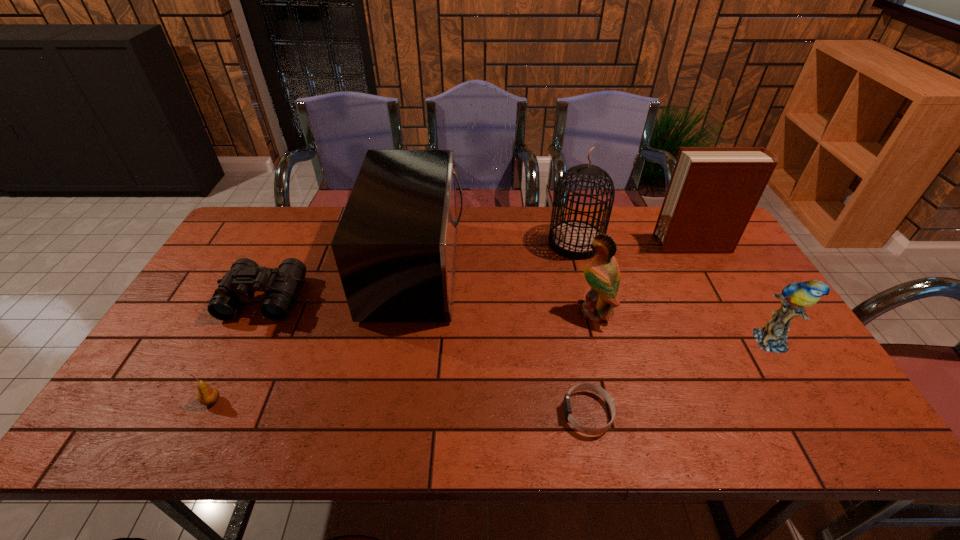
Where is `object present at the far right corner`? The height and width of the screenshot is (540, 960). object present at the far right corner is located at coordinates (713, 191).

Find the location of `free space at the far edge of the desktop`. free space at the far edge of the desktop is located at coordinates (527, 230).

Image resolution: width=960 pixels, height=540 pixels. Identify the location of free space at the near edge of the desktop. (257, 417).

Locate an element on the screen. This screenshot has height=540, width=960. free space at the left edge of the desktop is located at coordinates (171, 365).

In the image, there is a desktop. At what (x,y) coordinates should I click in order to perform the action: click on vacant space at the right edge. Please return your answer as a coordinate pair (x, y). Image resolution: width=960 pixels, height=540 pixels. Looking at the image, I should click on [711, 278].

Locate an element on the screen. Image resolution: width=960 pixels, height=540 pixels. free space between the seventh tallest object and the hardback book is located at coordinates (453, 323).

This screenshot has height=540, width=960. Find the location of `unoccupied area between the sixth object from right to left and the seventh tallest object`. unoccupied area between the sixth object from right to left and the seventh tallest object is located at coordinates (314, 335).

The height and width of the screenshot is (540, 960). I want to click on vacant area that lies between the microwave oven and the binoculars, so pos(340,284).

Identify the location of free space between the left parrot and the pear. The height and width of the screenshot is (540, 960). (403, 356).

You are a GUI agent. You are given a task and a screenshot of the screen. Output one action in this format:
    pyautogui.click(x=<x>, y=<y>)
    Task: Click on the vacant space that is in between the hardback book and the right parrot
    The width and height of the screenshot is (960, 540).
    Given the screenshot: What is the action you would take?
    pyautogui.click(x=732, y=293)